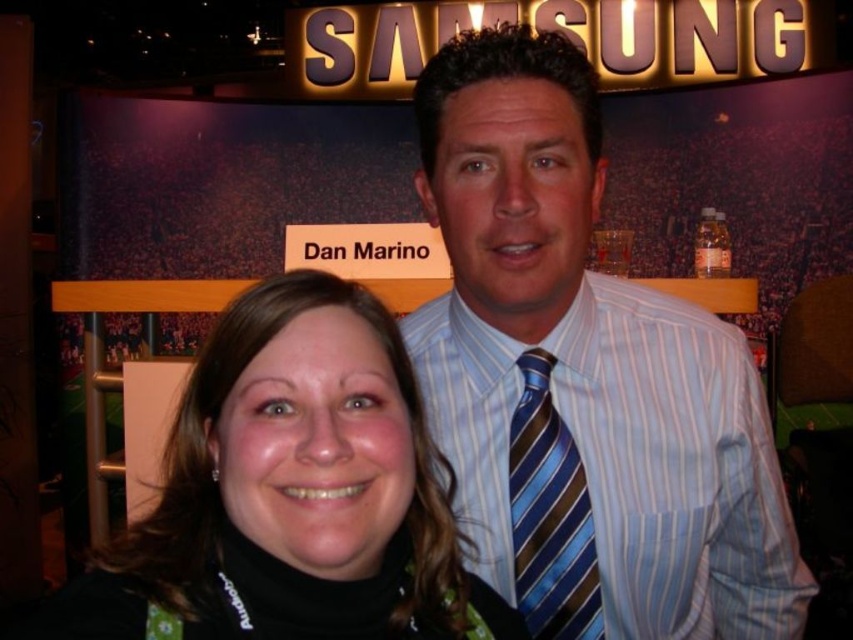
Question: Which object appears closest to the camera in this image?

Choices:
 (A) blue striped tie at center
 (B) black matte hair at center

Answer: (B)

Question: Does black matte hair at center have a lesser width compared to blue striped tie at center?

Choices:
 (A) no
 (B) yes

Answer: (A)

Question: Does black matte hair at center lie behind blue striped tie at center?

Choices:
 (A) yes
 (B) no

Answer: (B)

Question: Is blue striped shirt at center below black matte hair at center?

Choices:
 (A) yes
 (B) no

Answer: (B)

Question: Which of the following is the closest to the observer?

Choices:
 (A) (74, 612)
 (B) (494, 429)

Answer: (A)

Question: Considering the real-world distances, which object is closest to the blue striped shirt at center?

Choices:
 (A) black matte hair at center
 (B) blue striped tie at center

Answer: (B)